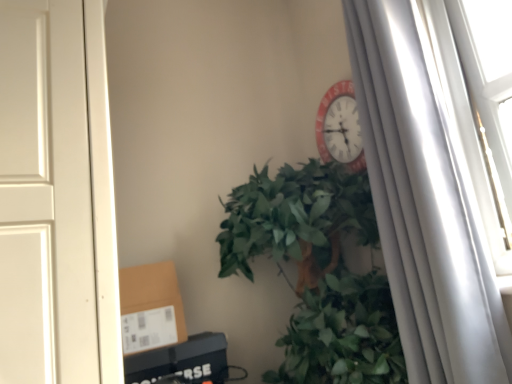
Question: Is brown cardboard box at lower left at the back of green leafy plant at center?

Choices:
 (A) yes
 (B) no

Answer: (B)

Question: Does green leafy plant at center have a lesser width compared to brown cardboard box at lower left?

Choices:
 (A) yes
 (B) no

Answer: (B)

Question: Does green leafy plant at center have a greater width compared to brown cardboard box at lower left?

Choices:
 (A) yes
 (B) no

Answer: (A)

Question: Are green leafy plant at center and brown cardboard box at lower left far apart?

Choices:
 (A) no
 (B) yes

Answer: (A)

Question: Can you confirm if green leafy plant at center is shorter than brown cardboard box at lower left?

Choices:
 (A) no
 (B) yes

Answer: (A)

Question: Visually, is green leafy plant at center positioned to the left or to the right of white matte curtain at right?

Choices:
 (A) right
 (B) left

Answer: (B)

Question: Do you think green leafy plant at center is within white matte curtain at right, or outside of it?

Choices:
 (A) inside
 (B) outside

Answer: (B)

Question: Considering their positions, is green leafy plant at center located in front of or behind white matte curtain at right?

Choices:
 (A) front
 (B) behind

Answer: (A)

Question: In terms of width, does green leafy plant at center look wider or thinner when compared to white matte curtain at right?

Choices:
 (A) wide
 (B) thin

Answer: (A)

Question: In terms of height, does brown cardboard box at lower left look taller or shorter compared to white matte curtain at right?

Choices:
 (A) short
 (B) tall

Answer: (A)

Question: From the image's perspective, is brown cardboard box at lower left positioned above or below white matte curtain at right?

Choices:
 (A) below
 (B) above

Answer: (A)

Question: Does point (152, 266) appear closer or farther from the camera than point (420, 278)?

Choices:
 (A) farther
 (B) closer

Answer: (A)

Question: Looking at the image, does brown cardboard box at lower left seem bigger or smaller compared to white matte curtain at right?

Choices:
 (A) small
 (B) big

Answer: (A)

Question: From the image's perspective, is brown cardboard box at lower left located above or below green leafy plant at center?

Choices:
 (A) below
 (B) above

Answer: (A)

Question: From a real-world perspective, is brown cardboard box at lower left physically located above or below green leafy plant at center?

Choices:
 (A) below
 (B) above

Answer: (A)